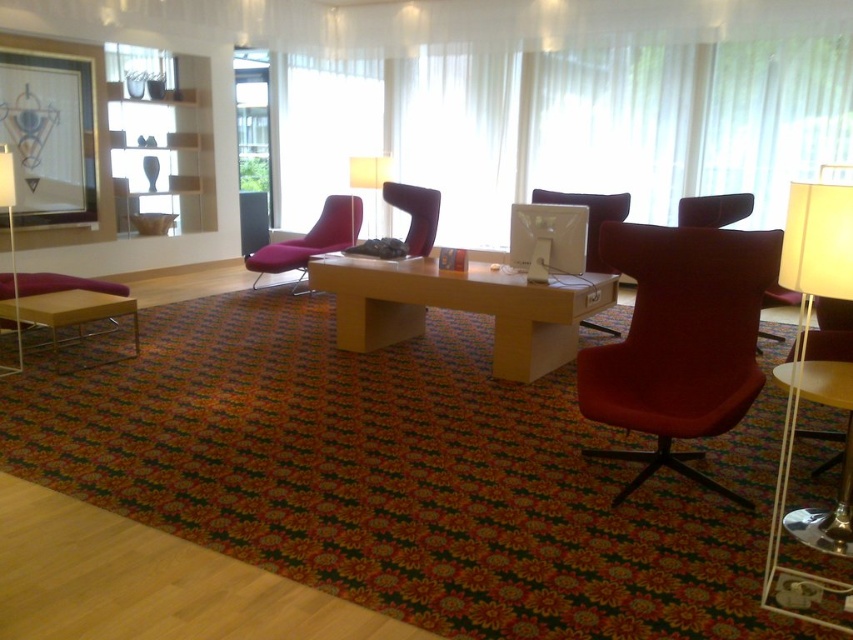
Question: Which point is closer to the camera?

Choices:
 (A) (491, 312)
 (B) (13, 316)

Answer: (A)

Question: Observing the image, what is the correct spatial positioning of matte black picture frame at upper left in reference to clear glass window at upper center?

Choices:
 (A) above
 (B) below

Answer: (B)

Question: Where is satin red swivel chair at center located in relation to matte white lampshade at center in the image?

Choices:
 (A) right
 (B) left

Answer: (A)

Question: Which of these objects is positioned farthest from the light wood/woodenobject at center?

Choices:
 (A) satin red swivel chair at center
 (B) wooden coffee table at lower left
 (C) matte black picture frame at upper left

Answer: (C)

Question: Which point appears farthest from the camera in this image?

Choices:
 (A) (270, 224)
 (B) (575, 250)
 (C) (0, 372)

Answer: (A)

Question: From the image, what is the correct spatial relationship of white glossy monitor at center in relation to white fabric lampshade at left?

Choices:
 (A) below
 (B) above

Answer: (B)